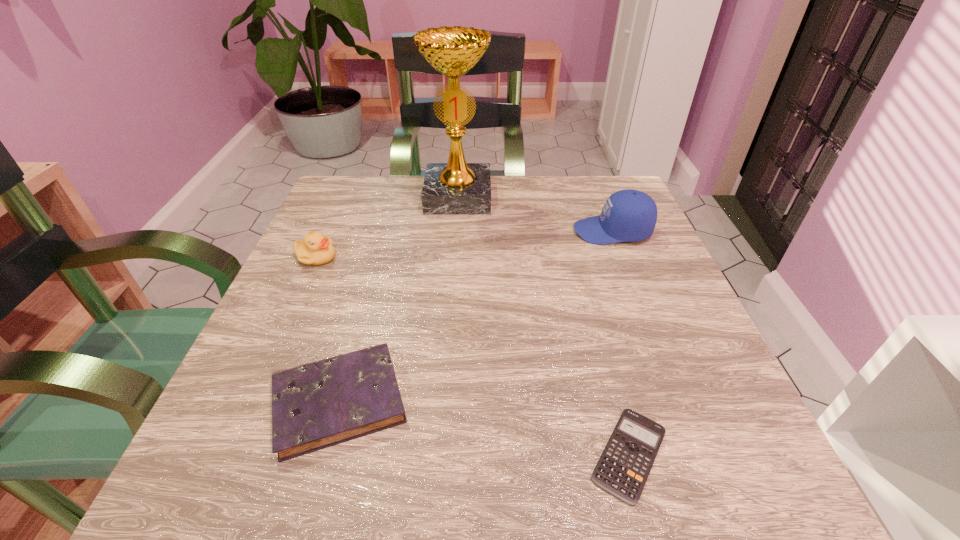
Where is `vacant point located 0.140m at the face of the third shortest object`? vacant point located 0.140m at the face of the third shortest object is located at coordinates (404, 257).

The height and width of the screenshot is (540, 960). I want to click on blank space located 0.240m on the right of the diary, so click(573, 401).

Find the location of a particular element. This screenshot has width=960, height=540. vacant point located 0.280m on the left of the shortest object is located at coordinates (376, 454).

Where is `award located at the far edge`? Image resolution: width=960 pixels, height=540 pixels. award located at the far edge is located at coordinates (455, 188).

This screenshot has height=540, width=960. I want to click on cap that is at the far edge, so click(x=628, y=215).

Locate an element on the screen. Image resolution: width=960 pixels, height=540 pixels. diary that is at the near edge is located at coordinates 317,405.

Image resolution: width=960 pixels, height=540 pixels. I want to click on calculator located in the near edge section of the desktop, so click(x=624, y=466).

This screenshot has width=960, height=540. In order to click on duckling positioned at the left edge in this screenshot , I will do `click(315, 249)`.

I want to click on diary at the left edge, so click(317, 405).

At what (x,y) coordinates should I click in order to perform the action: click on cap at the right edge. Please return your answer as a coordinate pair (x, y). This screenshot has width=960, height=540. Looking at the image, I should click on (628, 215).